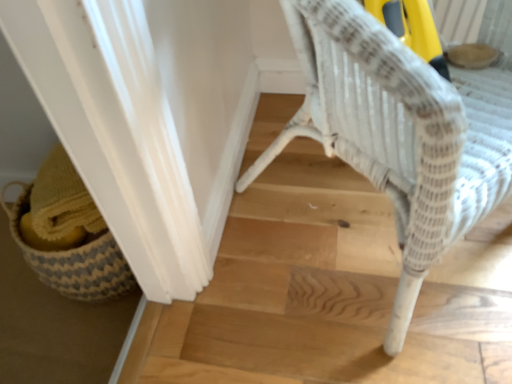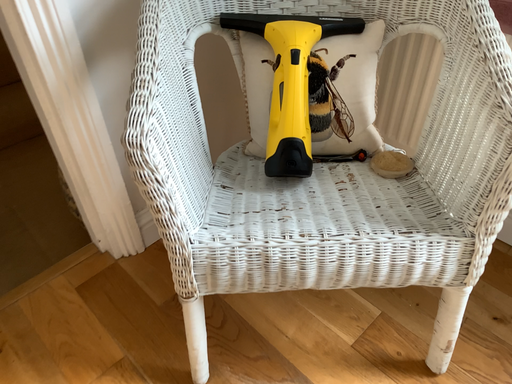
Question: Which way did the camera rotate in the video?

Choices:
 (A) rotated downward
 (B) rotated upward

Answer: (B)